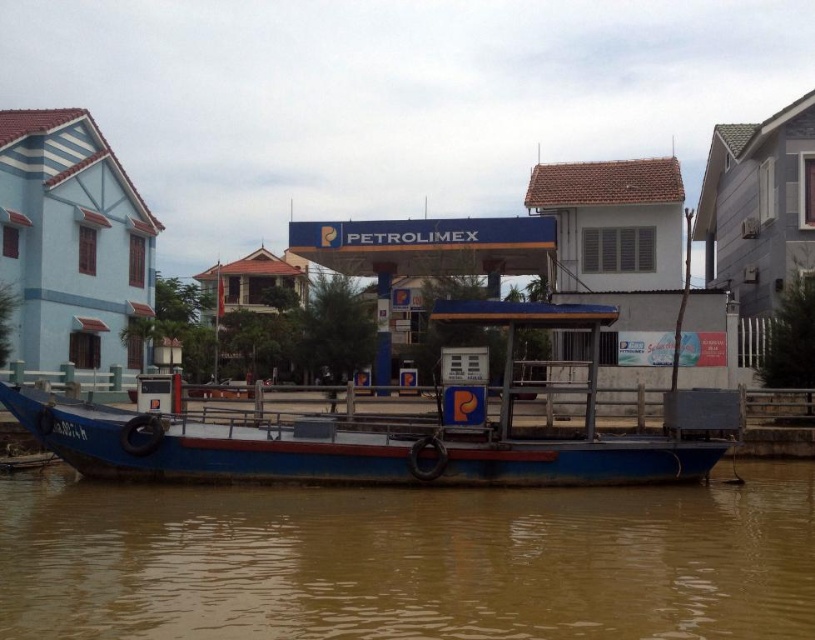
You are a delivery driver who needs to cross the river using the small blue boat with a red stripe. The GPS shows that the brown muddy water at lower center is at coordinates point 0.877, 0.502. Is this point safe for the boat to pass through?

The brown muddy water at lower center is located at point (408, 561), so it is safe for the boat to pass through this point as it is the designated area for the boat to navigate.

You are a boat operator who needs to navigate your blue matte boat at center to the left side of the river. Based on the scene, will the brown muddy water at lower center block your path?

The brown muddy water at lower center is to the right of the blue matte boat at center, so moving the boat to the left side of the river would avoid the muddy water. Therefore, the path should be clear of obstruction from the brown muddy water at lower center.

You are a delivery driver who needs to cross the river to reach the Petrolimex gas station. The boat you see is the only one available. Can your 2.5 meter long delivery van safely fit on the blue matte boat at center without overhanging into the brown muddy water at lower center?

The distance between the brown muddy water at lower center and the blue matte boat at center is 2.28 meters. Since the van is 2.5 meters long, it is longer than the available space. Therefore, the van cannot safely fit on the boat without overhanging into the brown muddy water at lower center.